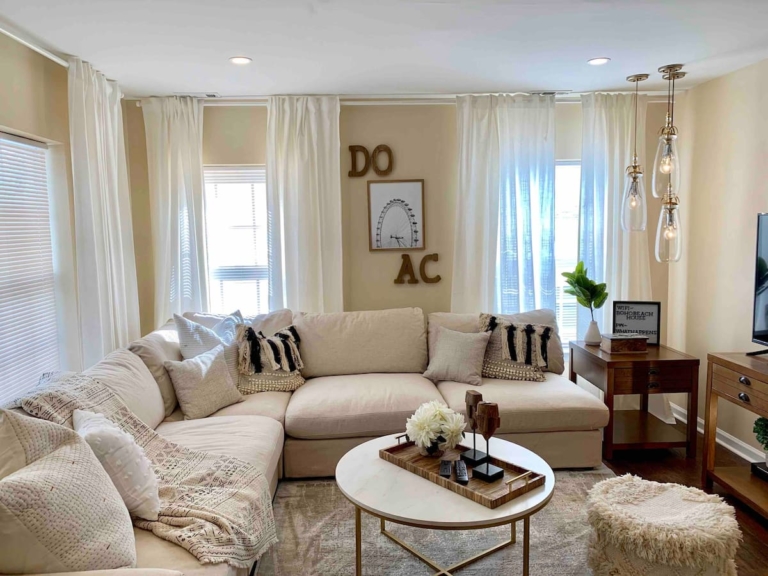
Where is `sofa`? The height and width of the screenshot is (576, 768). sofa is located at coordinates (227, 439), (386, 414).